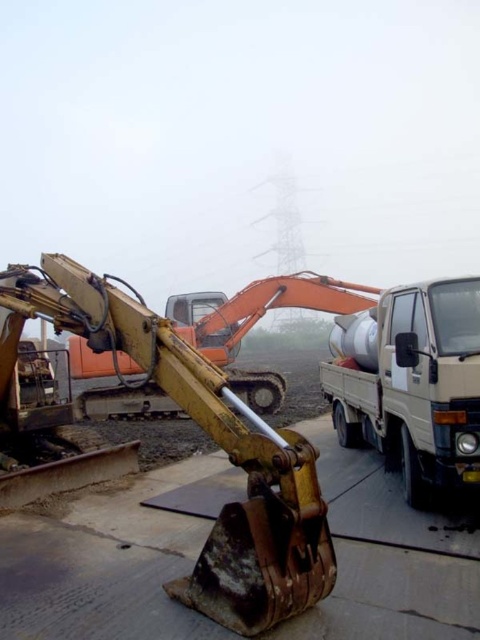
You are standing at the camera position and want to reach the point marked at coordinates (92, 570). The excavator is in your path. Can you walk around the excavator to reach the point without going through it?

The point marked at coordinates (92, 570) is 12.73 feet away from the camera position. Since the excavator is in the foreground and its arm is extended towards the right side of the frame, you can walk around it to reach the point without going through it.

You are a delivery driver who needs to pass through the construction site. You have a truck that is 2 meters wide. Can your truck fit between the rusty metal cement at lower center and the white matte truck at lower right?

The rusty metal cement at lower center is wider than the white matte truck at lower right. Since the path between them would depend on their widths, but the exact distance isn

You are a delivery driver who needs to back up your truck to the loading zone near the white matte truck at lower right. There is a rusty metal cement at lower center in the way. Can you safely maneuver around it to reach the loading zone?

The rusty metal cement at lower center is positioned on the left side of the white matte truck at lower right, so you can safely maneuver around it by moving to the right side of the rusty metal cement at lower center to reach the loading zone.